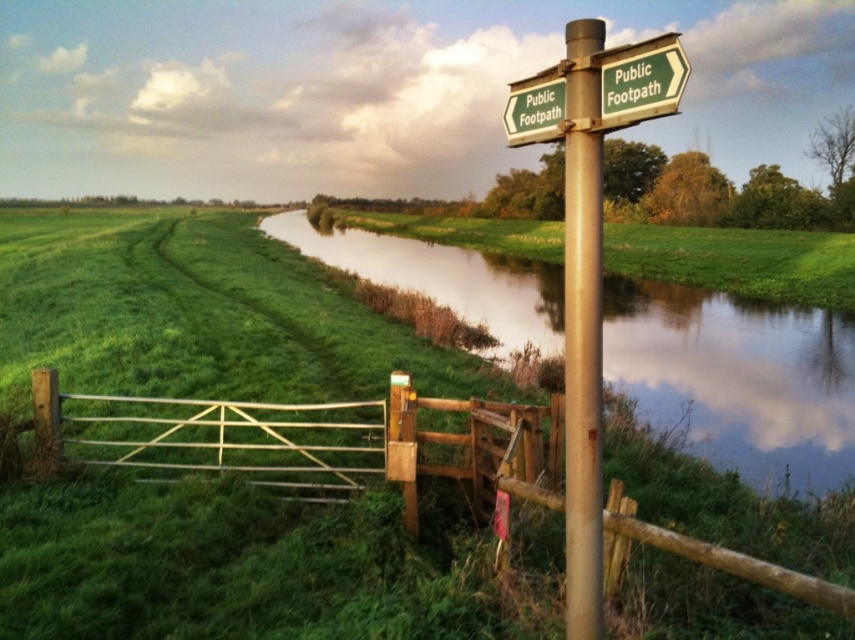
Question: Does green grassy at center have a larger size compared to green wooden signpost at upper right?

Choices:
 (A) yes
 (B) no

Answer: (A)

Question: Which object is positioned closest to the metallic pole at center-right?

Choices:
 (A) wooden gate at center
 (B) green wooden signpost at upper right
 (C) green grassy river at center
 (D) green grassy at center

Answer: (B)

Question: Which point is closer to the camera taking this photo?

Choices:
 (A) (821, 356)
 (B) (559, 72)
 (C) (593, 588)
 (D) (479, 237)

Answer: (B)

Question: Is wooden gate at center to the right of green grassy at center from the viewer's perspective?

Choices:
 (A) yes
 (B) no

Answer: (B)

Question: Where is green grassy at center located in relation to green wooden signpost at upper right in the image?

Choices:
 (A) right
 (B) left

Answer: (A)

Question: Which object appears closest to the camera in this image?

Choices:
 (A) wooden gate at center
 (B) green wooden signpost at upper right
 (C) metallic pole at center-right
 (D) green grassy river at center

Answer: (B)